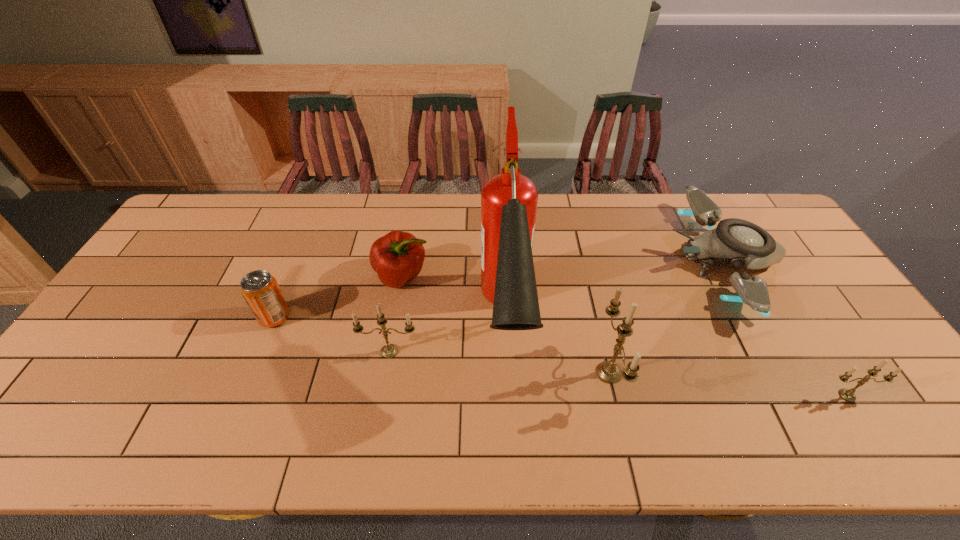
All candles are currently evenly spaced. To continue this pattern, where would you add another candle on the left? Please point out a vacant spot. Please provide its 2D coordinates. Your answer should be formatted as a tuple, i.e. [(x, y)], where the tuple contains the x and y coordinates of a point satisfying the conditions above.

[(186, 332)]